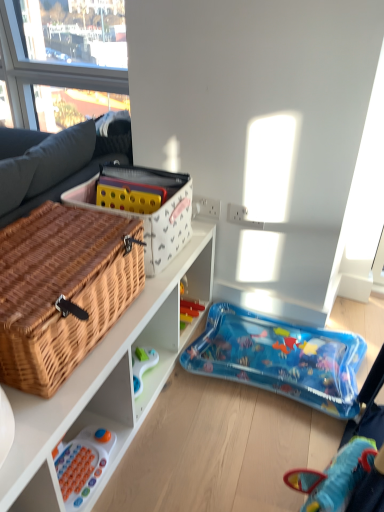
Question: Is white fabric storage box at upper center shorter than blue inflatable pool at lower right, which appears as the second toy when viewed from the left?

Choices:
 (A) no
 (B) yes

Answer: (A)

Question: Does white fabric storage box at upper center have a lesser width compared to blue inflatable pool at lower right, which is the first toy in back-to-front order?

Choices:
 (A) yes
 (B) no

Answer: (A)

Question: Does white fabric storage box at upper center touch blue inflatable pool at lower right, the second toy in the front-to-back sequence?

Choices:
 (A) no
 (B) yes

Answer: (A)

Question: Does white fabric storage box at upper center have a smaller size compared to blue inflatable pool at lower right, the first toy when ordered from top to bottom?

Choices:
 (A) no
 (B) yes

Answer: (B)

Question: From a real-world perspective, is white fabric storage box at upper center under blue inflatable pool at lower right, which is the first toy in back-to-front order?

Choices:
 (A) yes
 (B) no

Answer: (B)

Question: Is white fabric storage box at upper center far away from blue inflatable pool at lower right, which is the first toy in back-to-front order?

Choices:
 (A) no
 (B) yes

Answer: (A)

Question: Is woven brown picnic basket at left surrounding woven wood cabinet at lower left?

Choices:
 (A) yes
 (B) no

Answer: (B)

Question: Considering the relative positions of woven brown picnic basket at left and woven wood cabinet at lower left in the image provided, is woven brown picnic basket at left to the left of woven wood cabinet at lower left from the viewer's perspective?

Choices:
 (A) yes
 (B) no

Answer: (A)

Question: From the image's perspective, is woven brown picnic basket at left beneath woven wood cabinet at lower left?

Choices:
 (A) yes
 (B) no

Answer: (B)

Question: Is woven brown picnic basket at left completely or partially outside of woven wood cabinet at lower left?

Choices:
 (A) yes
 (B) no

Answer: (A)

Question: Does woven brown picnic basket at left have a lesser height compared to woven wood cabinet at lower left?

Choices:
 (A) no
 (B) yes

Answer: (A)

Question: Considering the relative positions of woven brown picnic basket at left and woven wood cabinet at lower left in the image provided, is woven brown picnic basket at left to the right of woven wood cabinet at lower left from the viewer's perspective?

Choices:
 (A) yes
 (B) no

Answer: (B)

Question: From the image's perspective, would you say white fabric storage box at upper center is shown under white plastic toy at lower left, which is the 1th toy from front to back?

Choices:
 (A) no
 (B) yes

Answer: (A)